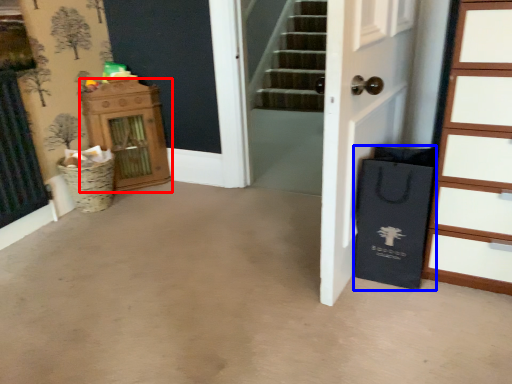
Question: Which point is further to the camera, dresser (highlighted by a red box) or shopping bag (highlighted by a blue box)?

Choices:
 (A) dresser
 (B) shopping bag

Answer: (A)